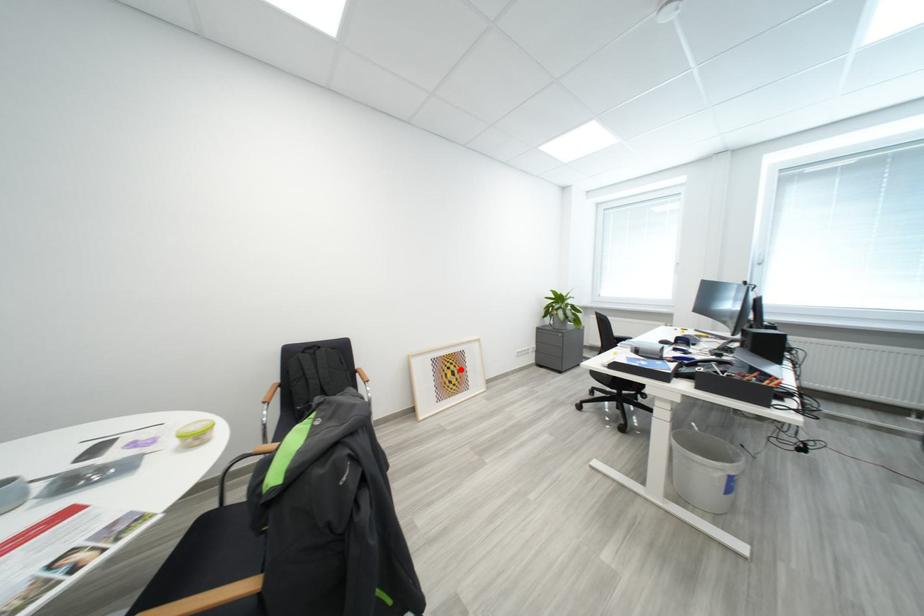
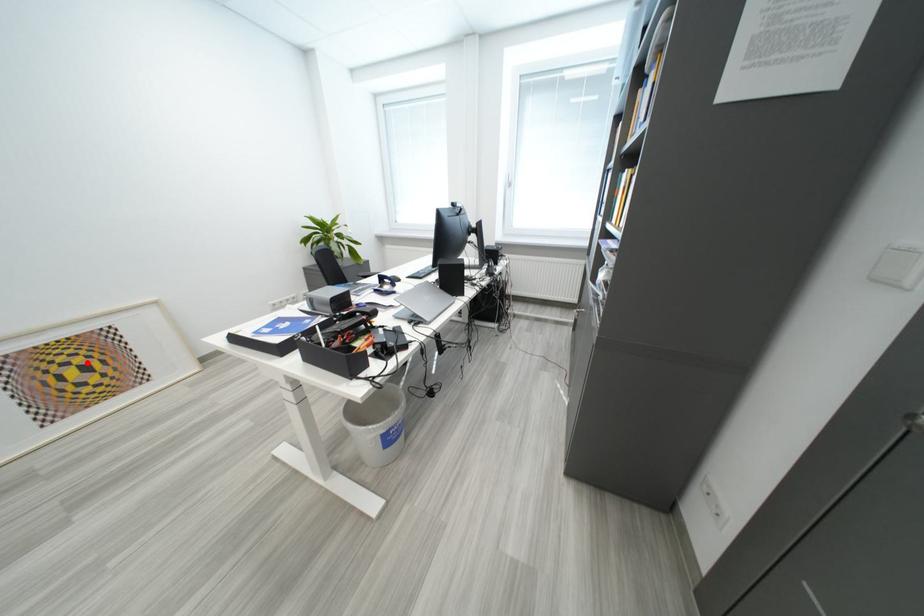
I am providing you with two images of the same scene from different viewpoints. A red point is marked on the first image and another point is marked on the second image. Does the point marked in image1 correspond to the same location as the one in image2?

Yes